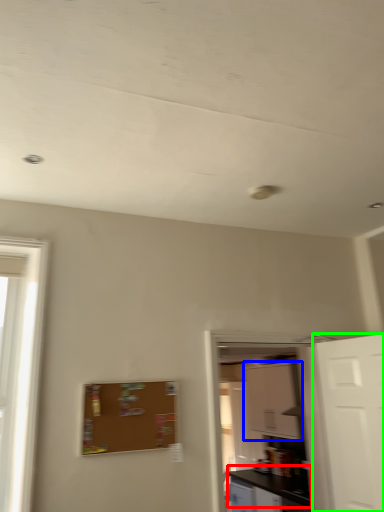
Question: Based on their relative distances, which object is nearer to counter top (highlighted by a red box)? Choose from cabinetry (highlighted by a blue box) and door (highlighted by a green box).

Choices:
 (A) cabinetry
 (B) door

Answer: (A)